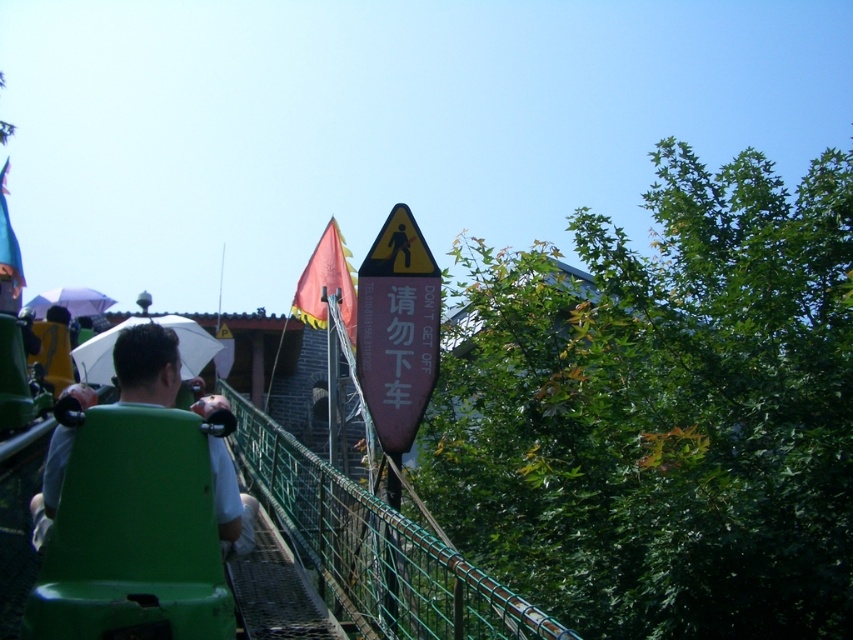
The image size is (853, 640). Describe the element at coordinates (397, 330) in the screenshot. I see `pink matte sign at center` at that location.

Is point (361, 301) less distant than point (38, 314)?

That is True.

Find the location of `pink matte sign at center`. pink matte sign at center is located at coordinates (397, 330).

Can you confirm if green plastic chair at center is shorter than matte black helmet at left?

Incorrect, green plastic chair at center's height does not fall short of matte black helmet at left's.

Find the location of a particular element. This screenshot has width=853, height=640. green plastic chair at center is located at coordinates (148, 365).

Does white matte umbrella at upper center appear on the right side of white matte umbrella at upper left?

Correct, you'll find white matte umbrella at upper center to the right of white matte umbrella at upper left.

Is white matte umbrella at upper center wider than white matte umbrella at upper left?

No.

Between point (78, 355) and point (38, 304), which one is positioned in front?

Point (78, 355) is more forward.

I want to click on white matte umbrella at upper center, so click(144, 323).